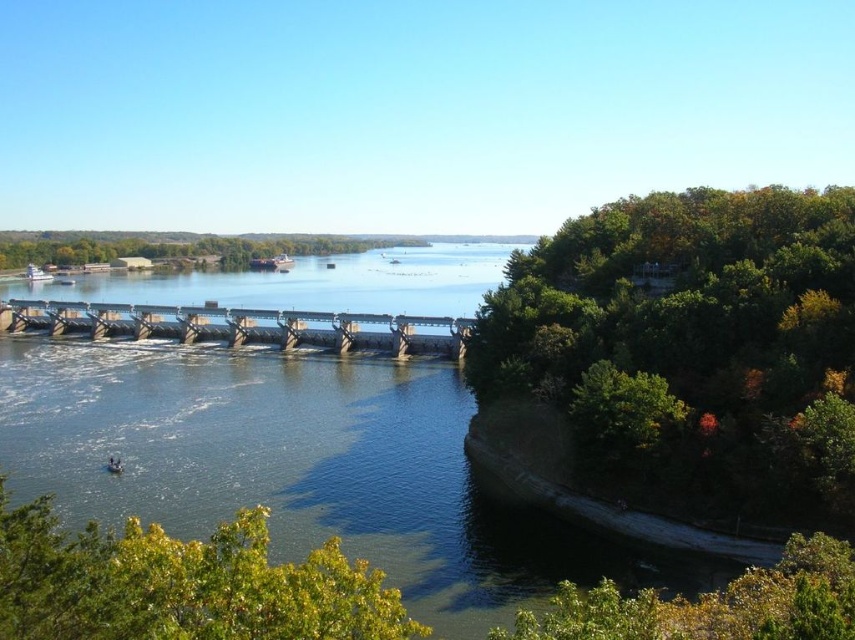
You are a kayaker planning to navigate the river from the white plastic boat at left towards the concrete dam at center. Given that your kayak can safely handle currents up to 2 meters per second, and the distance between the two points is 215.59 meters, what is the minimum time required to reach the dam without exceeding your kayak safety limits?

The minimum time required to reach the concrete dam at center from the white plastic boat at left without exceeding the kayak safety limits is 107.795 seconds. This is calculated by dividing the distance of 215.59 meters by the maximum safe speed of 2 meters per second.

You are a drone operator planning to capture aerial footage of the point at coordinates (x=219, y=316). The drone has a maximum flight range of 160 meters. Will the drone be able to reach the point from your current position?

The point at coordinates (x=219, y=316) is 162.23 meters away, which exceeds the drone operator maximum flight range of 160 meters. The drone will not be able to reach the point from the current position.